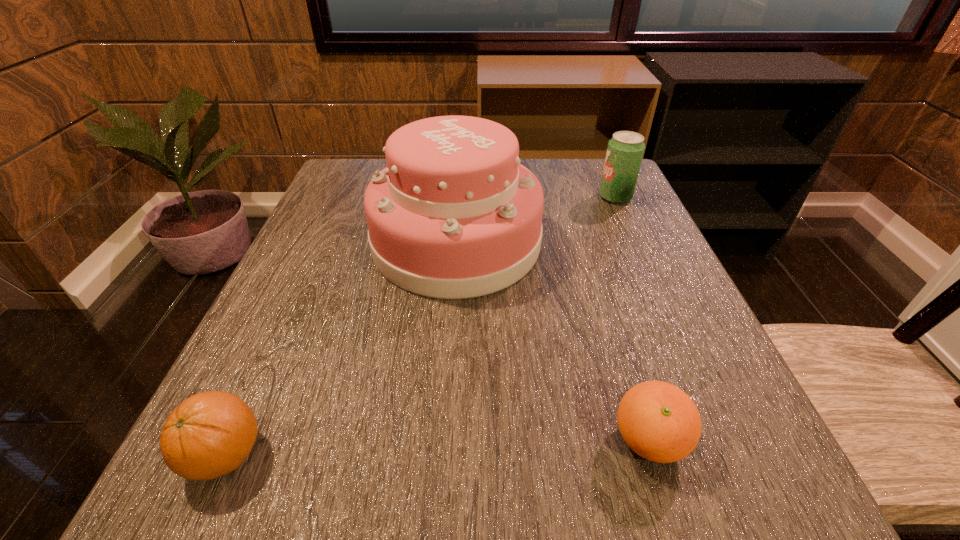
The height and width of the screenshot is (540, 960). In order to click on vacant region at the far edge of the desktop in this screenshot , I will do (x=551, y=201).

Where is `vacant space at the near edge of the desktop`? This screenshot has height=540, width=960. vacant space at the near edge of the desktop is located at coordinates (489, 455).

Identify the location of vacant space at the left edge of the desktop. Image resolution: width=960 pixels, height=540 pixels. (300, 244).

Find the location of a particular element. The width and height of the screenshot is (960, 540). vacant space at the right edge of the desktop is located at coordinates (631, 317).

Where is `vacant space at the far left corner`? The image size is (960, 540). vacant space at the far left corner is located at coordinates (374, 169).

Find the location of a particular element. free region at the far right corner of the desktop is located at coordinates (562, 176).

Where is `blank region between the birthday cake and the leftmost object`? blank region between the birthday cake and the leftmost object is located at coordinates (x=341, y=348).

Where is `vacant space that is in between the leftmost object and the soda`? This screenshot has height=540, width=960. vacant space that is in between the leftmost object and the soda is located at coordinates click(420, 326).

Where is `vacant region between the second object from right to left and the soda`? vacant region between the second object from right to left and the soda is located at coordinates (632, 319).

Identify the location of vacant space that is in between the left orange and the second object from right to left. The image size is (960, 540). (437, 448).